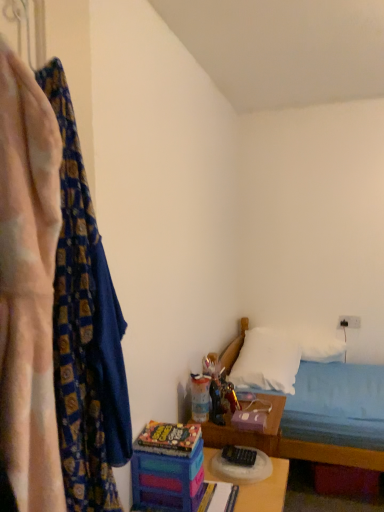
Find the location of a particular element. The image size is (384, 512). multicolored plastic table at center is located at coordinates (264, 490).

In order to face translucent plastic toy at center, the second toy in the front-to-back sequence, should I rotate leftwards or rightwards?

You should look right and rotate roughly 2.399 degrees.

You are a GUI agent. You are given a task and a screenshot of the screen. Output one action in this format:
    pyautogui.click(x=<x>, y=<y>)
    Task: Click on the white soft pillow at upper right, the first pillow in the back-to-front sequence
    The image size is (384, 512).
    Given the screenshot: What is the action you would take?
    pyautogui.click(x=315, y=343)

Describe the element at coordinates (167, 470) in the screenshot. The width and height of the screenshot is (384, 512). I see `multicolored plastic toy at lower center, which is the 1th toy in left-to-right order` at that location.

This screenshot has width=384, height=512. What are the coordinates of `white soft pillow at lower right, the 1th pillow from the front` in the screenshot? It's located at tap(266, 361).

Measure the distance between point (350, 452) and camera.

2.14 meters.

At what (x,y) coordinates should I click in order to perform the action: click on white fabric bed at lower right. Please return your answer as a coordinate pair (x, y). This screenshot has width=384, height=512. Looking at the image, I should click on (328, 442).

The width and height of the screenshot is (384, 512). What are the coordinates of `multicolored plastic table at center` in the screenshot? It's located at (264, 490).

Looking at this image, considering their positions, is patterned fabric curtain at left, which ranks as the 1th curtain in front-to-back order, located in front of or behind multicolored plastic toy at lower center, arranged as the second toy when viewed from the right?

patterned fabric curtain at left, which ranks as the 1th curtain in front-to-back order, is in front of multicolored plastic toy at lower center, arranged as the second toy when viewed from the right.

Looking at this image, could you tell me if patterned fabric curtain at left, which ranks as the 1th curtain in front-to-back order, is turned towards multicolored plastic toy at lower center, which is the 1th toy in left-to-right order?

No, patterned fabric curtain at left, which ranks as the 1th curtain in front-to-back order, is not oriented towards multicolored plastic toy at lower center, which is the 1th toy in left-to-right order.

Is multicolored plastic toy at lower center, which is the 1th toy in left-to-right order, a part of patterned fabric curtain at left, which ranks as the 1th curtain in front-to-back order?

No, patterned fabric curtain at left, which ranks as the 1th curtain in front-to-back order, does not contain multicolored plastic toy at lower center, which is the 1th toy in left-to-right order.

Between point (42, 465) and point (179, 498), which one is positioned in front?

Point (42, 465)

Which is closer, (4, 300) or (254, 490)?

Point (4, 300)

From the image's perspective, starting from the multicolored plastic table at center, which curtain is the 2nd one above? Please provide its 2D coordinates.

[(28, 287)]

Considering the sizes of objects patterned fabric curtain at left, which ranks as the 1th curtain in front-to-back order, and multicolored plastic table at center in the image provided, who is smaller, patterned fabric curtain at left, which ranks as the 1th curtain in front-to-back order, or multicolored plastic table at center?

patterned fabric curtain at left, which ranks as the 1th curtain in front-to-back order.

Is point (254, 359) farther from viewer compared to point (224, 384)?

That is True.

From a real-world perspective, relative to translucent plastic toy at center, which is counted as the first toy, starting from the back, is white soft pillow at lower right, the 2th pillow in the back-to-front sequence, vertically above or below?

From a real-world perspective, white soft pillow at lower right, the 2th pillow in the back-to-front sequence, is physically below translucent plastic toy at center, which is counted as the first toy, starting from the back.

From the picture: Who is bigger, white soft pillow at lower right, the 1th pillow from the front, or translucent plastic toy at center, which is counted as the first toy, starting from the back?

Bigger between the two is white soft pillow at lower right, the 1th pillow from the front.

Locate an element on the screen. Image resolution: width=384 pixels, height=512 pixels. the 2nd curtain directly above the white fabric bed at lower right (from a real-world perspective) is located at coordinates (28, 287).

From a real-world perspective, which object rests below the other?

white fabric bed at lower right, from a real-world perspective.

Is multicolored plastic toy at lower center, which ranks as the first toy in front-to-back order, at the right side of multicolored plastic table at center?

In fact, multicolored plastic toy at lower center, which ranks as the first toy in front-to-back order, is to the left of multicolored plastic table at center.

Starting from the multicolored plastic table at center, which toy is the 2nd one to the left? Please provide its 2D coordinates.

[(167, 470)]

Does multicolored plastic toy at lower center, the 2th toy in the back-to-front sequence, have a smaller size compared to multicolored plastic table at center?

Yes.

From a real-world perspective, is multicolored plastic toy at lower center, the 2th toy in the back-to-front sequence, positioned above or below multicolored plastic table at center?

In terms of real-world spatial position, multicolored plastic toy at lower center, the 2th toy in the back-to-front sequence, is above multicolored plastic table at center.

Considering the positions of objects white soft pillow at upper right, which appears as the second pillow when viewed from the front, and multicolored plastic table at center in the image provided, who is more to the right, white soft pillow at upper right, which appears as the second pillow when viewed from the front, or multicolored plastic table at center?

white soft pillow at upper right, which appears as the second pillow when viewed from the front.

Find the location of a particular element. The width and height of the screenshot is (384, 512). table directly beneath the white soft pillow at upper right, the first pillow in the back-to-front sequence (from a real-world perspective) is located at coordinates (264, 490).

From a real-world perspective, relative to multicolored plastic table at center, is white soft pillow at upper right, which appears as the second pillow when viewed from the front, vertically above or below?

From a real-world perspective, white soft pillow at upper right, which appears as the second pillow when viewed from the front, is physically above multicolored plastic table at center.

Is multicolored plastic table at center oriented towards translucent plastic toy at center, the second toy in the front-to-back sequence?

No, multicolored plastic table at center is not turned towards translucent plastic toy at center, the second toy in the front-to-back sequence.

In the image, is multicolored plastic table at center positioned in front of or behind translucent plastic toy at center, positioned as the 2th toy in left-to-right order?

In the image, multicolored plastic table at center appears in front of translucent plastic toy at center, positioned as the 2th toy in left-to-right order.

How different are the orientations of multicolored plastic table at center and translucent plastic toy at center, which is counted as the first toy, starting from the back, in degrees?

2.02 degrees separate the facing orientations of multicolored plastic table at center and translucent plastic toy at center, which is counted as the first toy, starting from the back.

Which toy is the 1st one when counting from the left side of the multicolored plastic table at center? Please provide its 2D coordinates.

[(218, 392)]

From the patterned fabric curtain at left, which ranks as the 1th curtain in front-to-back order, count 1st toy to the right and point to it. Please provide its 2D coordinates.

[(167, 470)]

From a real-world perspective, starting from the multicolored plastic table at center, which curtain is the 2nd one vertically above it? Please provide its 2D coordinates.

[(28, 287)]

Estimate the real-world distances between objects in this image. Which object is closer to patterned fabric curtain at left, which ranks as the 1th curtain in front-to-back order, white soft pillow at upper right, which appears as the second pillow when viewed from the front, or translucent plastic toy at center, positioned as the 2th toy in left-to-right order?

Among the two, translucent plastic toy at center, positioned as the 2th toy in left-to-right order, is located nearer to patterned fabric curtain at left, which ranks as the 1th curtain in front-to-back order.

Considering their positions, is white soft pillow at lower right, the 2th pillow in the back-to-front sequence, positioned further to white soft pillow at upper right, which appears as the second pillow when viewed from the front, than multicolored plastic toy at lower center, which ranks as the first toy in front-to-back order?

multicolored plastic toy at lower center, which ranks as the first toy in front-to-back order, is further to white soft pillow at upper right, which appears as the second pillow when viewed from the front.

Considering their positions, is multicolored plastic toy at lower center, the 2th toy in the back-to-front sequence, positioned closer to white fabric bed at lower right than white soft pillow at lower right, the 1th pillow from the front?

white soft pillow at lower right, the 1th pillow from the front, lies closer to white fabric bed at lower right than the other object.

Based on their spatial positions, is patterned fabric curtain at left, which ranks as the 1th curtain in front-to-back order, or white soft pillow at upper right, the first pillow in the back-to-front sequence, closer to multicolored plastic toy at lower center, the 2th toy in the back-to-front sequence?

patterned fabric curtain at left, which ranks as the 1th curtain in front-to-back order, is positioned closer to the anchor multicolored plastic toy at lower center, the 2th toy in the back-to-front sequence.

Considering their positions, is translucent plastic toy at center, positioned as the 2th toy in left-to-right order, positioned further to white soft pillow at upper right, the first pillow in the back-to-front sequence, than multicolored plastic table at center?

multicolored plastic table at center lies further to white soft pillow at upper right, the first pillow in the back-to-front sequence, than the other object.

When comparing their distances from white fabric bed at lower right, does translucent plastic toy at center, which is counted as the first toy, starting from the back, or white soft pillow at lower right, the 2th pillow in the back-to-front sequence, seem further?

The object further to white fabric bed at lower right is white soft pillow at lower right, the 2th pillow in the back-to-front sequence.

Based on the photo, when comparing their distances from multicolored plastic table at center, does white fabric bed at lower right or patterned fabric curtain at left, the first curtain viewed from the back, seem closer?

white fabric bed at lower right is positioned closer to the anchor multicolored plastic table at center.

When comparing their distances from translucent plastic toy at center, the second toy in the front-to-back sequence, does white fabric bed at lower right or white soft pillow at lower right, the 2th pillow in the back-to-front sequence, seem closer?

white fabric bed at lower right is positioned closer to the anchor translucent plastic toy at center, the second toy in the front-to-back sequence.

I want to click on table between patterned fabric curtain at left, marked as the second curtain in a front-to-back arrangement, and multicolored plastic toy at lower center, arranged as the second toy when viewed from the right, from front to back, so click(264, 490).

Identify the location of table between patterned fabric curtain at left, which ranks as the 1th curtain in front-to-back order, and translucent plastic toy at center, marked as the first toy in a right-to-left arrangement, along the z-axis. The width and height of the screenshot is (384, 512). (264, 490).

Identify the location of table between patterned fabric curtain at left, marked as the second curtain in a front-to-back arrangement, and white soft pillow at upper right, which appears as the second pillow when viewed from the front, in the front-back direction. The height and width of the screenshot is (512, 384). (264, 490).

You are a GUI agent. You are given a task and a screenshot of the screen. Output one action in this format:
    pyautogui.click(x=<x>, y=<y>)
    Task: Click on the bed between multicolored plastic toy at lower center, the 2th toy in the back-to-front sequence, and white soft pillow at lower right, the 1th pillow from the front, in the front-back direction
    
    Given the screenshot: What is the action you would take?
    pyautogui.click(x=328, y=442)